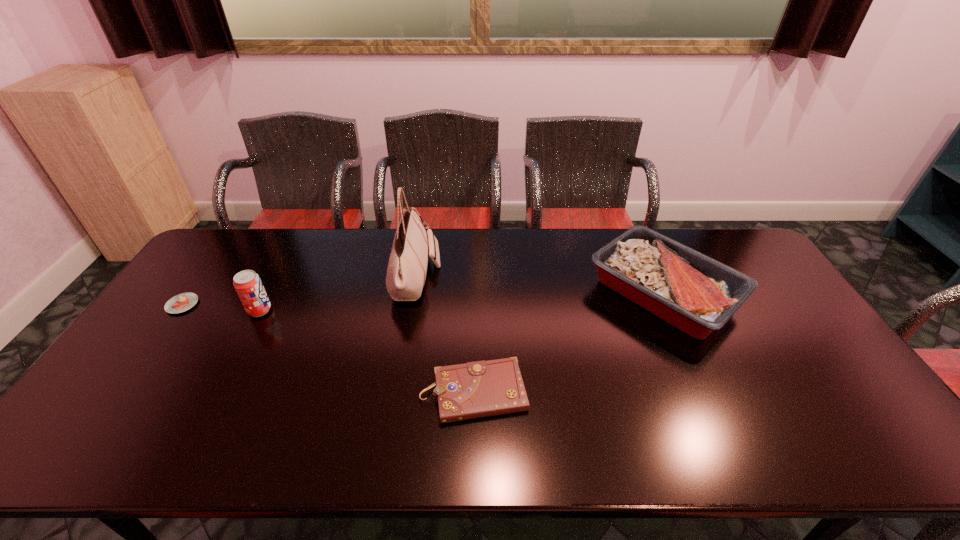
The height and width of the screenshot is (540, 960). Identify the location of free spot located on the left of the third shortest object. (540, 293).

You are a GUI agent. You are given a task and a screenshot of the screen. Output one action in this format:
    pyautogui.click(x=<x>, y=<y>)
    Task: Click on the vacant space located on the left of the nearest object
    
    Given the screenshot: What is the action you would take?
    pyautogui.click(x=277, y=392)

Where is `free spot located on the back of the leftmost object`? This screenshot has height=540, width=960. free spot located on the back of the leftmost object is located at coordinates 229,240.

This screenshot has height=540, width=960. Find the location of `handbag present at the far edge`. handbag present at the far edge is located at coordinates (406, 272).

The height and width of the screenshot is (540, 960). What are the coordinates of `tray located in the far edge section of the desktop` in the screenshot? It's located at (697, 294).

Where is `object at the left edge`? object at the left edge is located at coordinates (182, 302).

Where is `object that is at the right edge`? The height and width of the screenshot is (540, 960). object that is at the right edge is located at coordinates (697, 294).

At what (x,y) coordinates should I click in order to perform the action: click on object that is positioned at the far right corner. Please return your answer as a coordinate pair (x, y). The image size is (960, 540). Looking at the image, I should click on (697, 294).

This screenshot has width=960, height=540. What are the coordinates of `vacant space at the far edge of the desktop` in the screenshot? It's located at (517, 258).

Locate an element on the screen. This screenshot has height=540, width=960. blank area at the near edge is located at coordinates (681, 432).